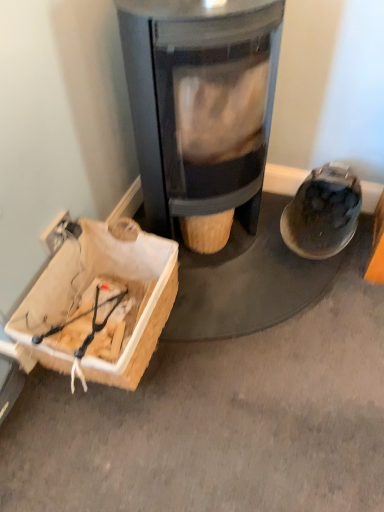
Question: Should I look upward or downward to see matte black wood burning stove at center?

Choices:
 (A) down
 (B) up

Answer: (B)

Question: Can you confirm if matte black shoe at right is smaller than wooden crate at lower left?

Choices:
 (A) no
 (B) yes

Answer: (B)

Question: Is matte black shoe at right positioned in front of wooden crate at lower left?

Choices:
 (A) no
 (B) yes

Answer: (A)

Question: Does matte black shoe at right have a larger size compared to wooden crate at lower left?

Choices:
 (A) no
 (B) yes

Answer: (A)

Question: From a real-world perspective, is matte black shoe at right on wooden crate at lower left?

Choices:
 (A) yes
 (B) no

Answer: (A)

Question: From the image's perspective, does matte black shoe at right appear higher than wooden crate at lower left?

Choices:
 (A) yes
 (B) no

Answer: (A)

Question: Are matte black shoe at right and wooden crate at lower left making contact?

Choices:
 (A) yes
 (B) no

Answer: (B)

Question: Is wooden crate at lower left next to matte black shoe at right?

Choices:
 (A) yes
 (B) no

Answer: (B)

Question: Is wooden crate at lower left wider than matte black shoe at right?

Choices:
 (A) no
 (B) yes

Answer: (A)

Question: Is wooden crate at lower left oriented towards matte black shoe at right?

Choices:
 (A) yes
 (B) no

Answer: (B)

Question: From a real-world perspective, is wooden crate at lower left positioned under matte black shoe at right based on gravity?

Choices:
 (A) no
 (B) yes

Answer: (B)

Question: From the image's perspective, does wooden crate at lower left appear lower than matte black shoe at right?

Choices:
 (A) yes
 (B) no

Answer: (A)

Question: Considering the relative sizes of wooden crate at lower left and matte black shoe at right in the image provided, is wooden crate at lower left bigger than matte black shoe at right?

Choices:
 (A) no
 (B) yes

Answer: (B)

Question: Is matte black wood burning stove at center inside matte black shoe at right?

Choices:
 (A) yes
 (B) no

Answer: (B)